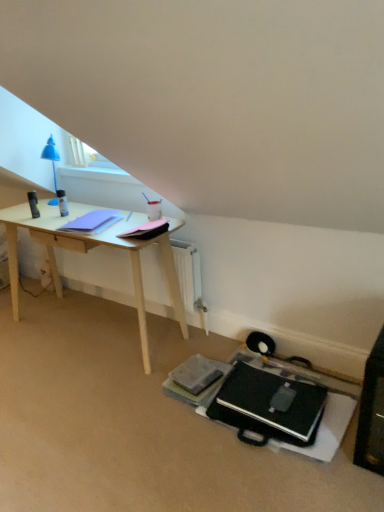
Question: Is pink matte notepad at center, the 2th notepad positioned from the left, positioned beyond the bounds of black matte laptop at lower center?

Choices:
 (A) no
 (B) yes

Answer: (B)

Question: Can you confirm if pink matte notepad at center, the 2th notepad positioned from the left, is thinner than black matte laptop at lower center?

Choices:
 (A) yes
 (B) no

Answer: (A)

Question: Does pink matte notepad at center, the 2th notepad positioned from the left, have a greater width compared to black matte laptop at lower center?

Choices:
 (A) no
 (B) yes

Answer: (A)

Question: Is pink matte notepad at center, the 2th notepad positioned from the left, smaller than black matte laptop at lower center?

Choices:
 (A) no
 (B) yes

Answer: (B)

Question: From the image's perspective, is pink matte notepad at center, which appears as the 1th notepad when viewed from the right, located above black matte laptop at lower center?

Choices:
 (A) yes
 (B) no

Answer: (A)

Question: Is pink matte notepad at center, which appears as the 1th notepad when viewed from the right, aimed at black matte laptop at lower center?

Choices:
 (A) yes
 (B) no

Answer: (B)

Question: Is pink matte notepad at center, the 2th notepad positioned from the left, shorter than matte purple notepad at left, the first notepad from the left?

Choices:
 (A) yes
 (B) no

Answer: (B)

Question: Is pink matte notepad at center, the 2th notepad positioned from the left, bigger than matte purple notepad at left, the first notepad from the left?

Choices:
 (A) yes
 (B) no

Answer: (B)

Question: Is pink matte notepad at center, the 2th notepad positioned from the left, directly adjacent to matte purple notepad at left, the first notepad from the left?

Choices:
 (A) yes
 (B) no

Answer: (B)

Question: Does pink matte notepad at center, the 2th notepad positioned from the left, appear on the left side of matte purple notepad at left, the 2th notepad viewed from the right?

Choices:
 (A) no
 (B) yes

Answer: (A)

Question: Is pink matte notepad at center, which appears as the 1th notepad when viewed from the right, in front of matte purple notepad at left, the first notepad from the left?

Choices:
 (A) yes
 (B) no

Answer: (A)

Question: Is matte purple notepad at left, the first notepad from the left, at the back of pink matte notepad at center, which appears as the 1th notepad when viewed from the right?

Choices:
 (A) no
 (B) yes

Answer: (A)

Question: Can you confirm if black matte laptop at lower center is smaller than pink matte notepad at center, the 2th notepad positioned from the left?

Choices:
 (A) yes
 (B) no

Answer: (B)